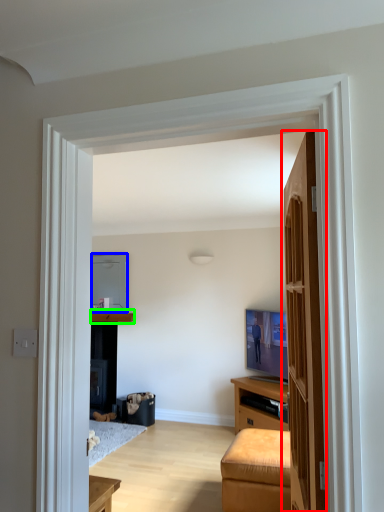
Question: Which is nearer to the door (highlighted by a red box)? appliance (highlighted by a blue box) or cabinetry (highlighted by a green box).

Choices:
 (A) appliance
 (B) cabinetry

Answer: (B)